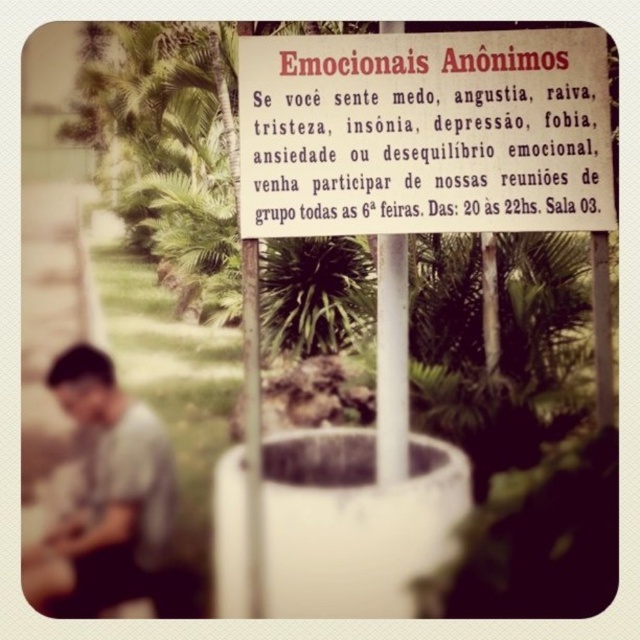
You are a passerby who wants to read the sign but is currently standing next to the gray matte shirt at lower left. Can you read the white paper sign at center without moving your head?

The white paper sign at center might be wider than gray matte shirt at lower left, so it is possible that the sign extends beyond the shirt, allowing you to read it without moving your head if positioned correctly.

You are a passerby who notices the white paper sign at center and the gray matte shirt at lower left. Which object is located to the right side of the other?

The white paper sign at center is to the right of gray matte shirt at lower left.